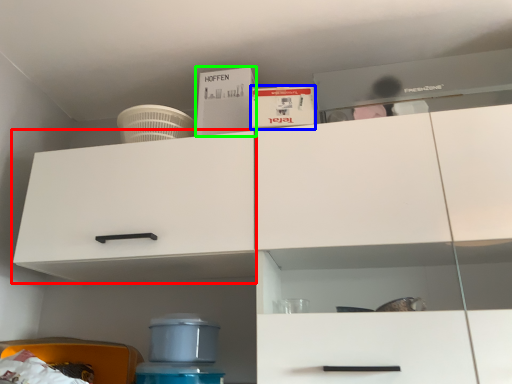
Question: Considering the real-world distances, which object is farthest from cabinetry (highlighted by a red box)? box (highlighted by a blue box) or box (highlighted by a green box)?

Choices:
 (A) box
 (B) box

Answer: (A)